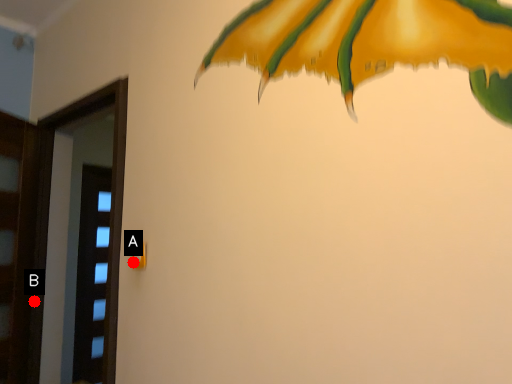
Question: Two points are circled on the image, labeled by A and B beside each circle. Which point is closer to the camera?

Choices:
 (A) A is closer
 (B) B is closer

Answer: (A)